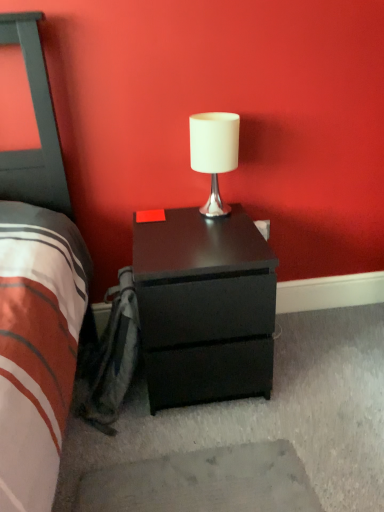
Where is `space that is in front of matte black nightstand at center`? The height and width of the screenshot is (512, 384). space that is in front of matte black nightstand at center is located at coordinates (216, 458).